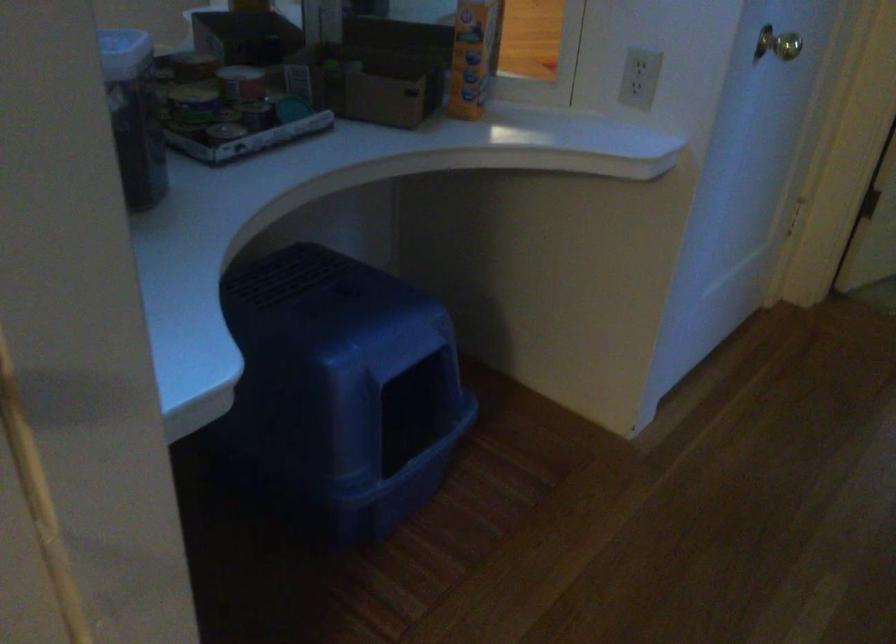
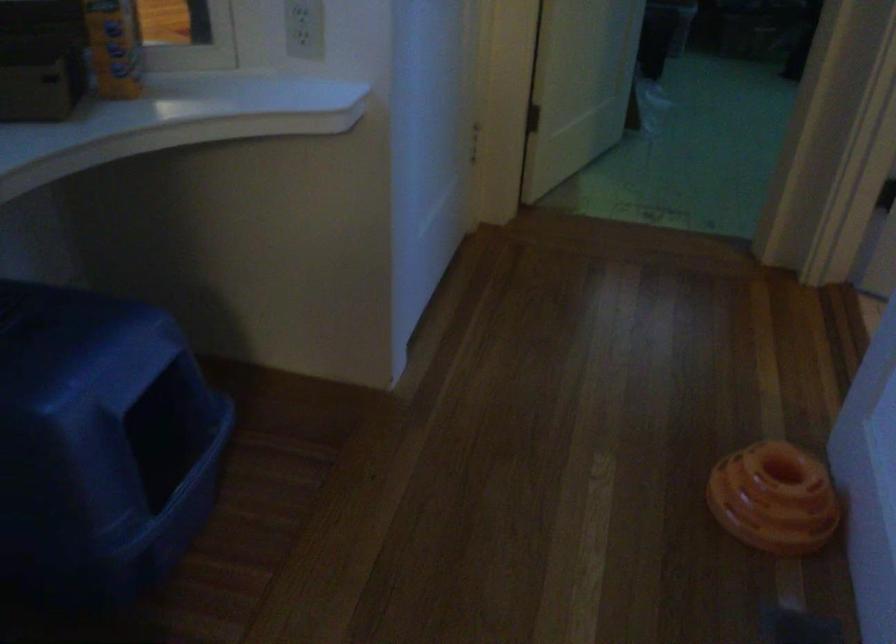
Find the pixel in the second image that matches the point at 350,395 in the first image.

(99, 442)